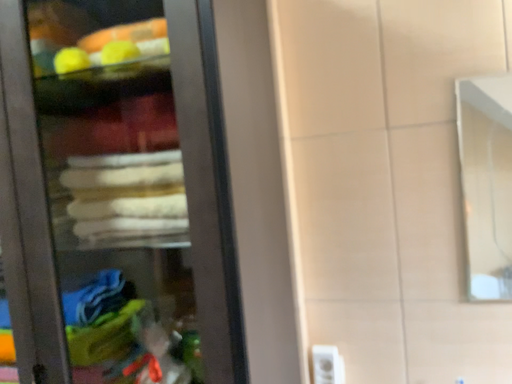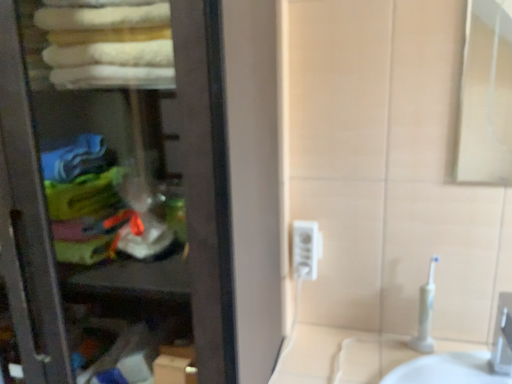
Question: Which way did the camera rotate in the video?

Choices:
 (A) rotated downward
 (B) rotated upward

Answer: (A)